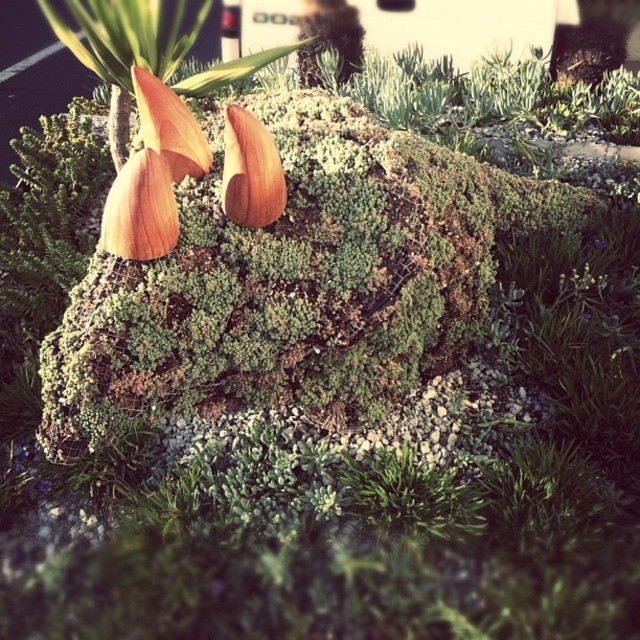
Between wooden flower at center and wooden petal at center, which one has less height?

With less height is wooden flower at center.

Does point (122, 179) lie behind point (275, 182)?

No, it is in front of (275, 182).

Which is in front, point (163, 204) or point (227, 205)?

Point (163, 204) is more forward.

Find the location of a particular element. The image size is (640, 640). wooden flower at center is located at coordinates (140, 209).

Between wooden flower at center and matte orange petal at center, which one appears on the right side from the viewer's perspective?

Positioned to the right is wooden flower at center.

Is wooden flower at center thinner than matte orange petal at center?

Yes, wooden flower at center is thinner than matte orange petal at center.

Does point (161, 241) lie in front of point (141, 90)?

Yes, point (161, 241) is in front of point (141, 90).

At what (x,y) coordinates should I click in order to perform the action: click on wooden flower at center. Please return your answer as a coordinate pair (x, y). The image size is (640, 640). Looking at the image, I should click on (140, 209).

In the scene shown: Is wooden petal at center bigger than matte orange petal at center?

Actually, wooden petal at center might be smaller than matte orange petal at center.

Identify the location of wooden petal at center. (250, 172).

At what (x,y) coordinates should I click in order to perform the action: click on wooden petal at center. Please return your answer as a coordinate pair (x, y). This screenshot has height=640, width=640. Looking at the image, I should click on (250, 172).